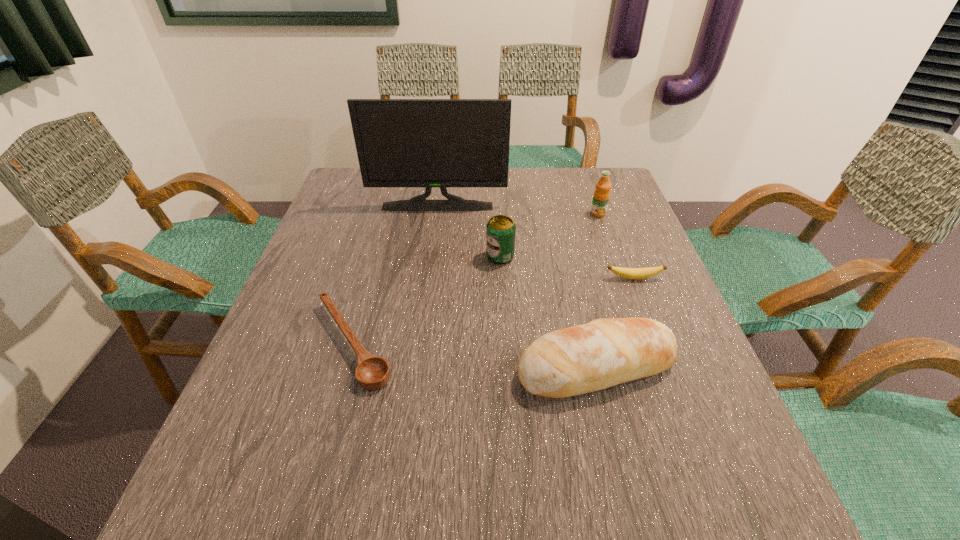
Identify the location of the tallest object. The image size is (960, 540). (428, 143).

This screenshot has height=540, width=960. I want to click on orange juice, so click(601, 196).

Locate an element on the screen. This screenshot has height=540, width=960. the third farthest object is located at coordinates (501, 230).

At what (x,y) coordinates should I click in order to perform the action: click on bread. Please return your answer as a coordinate pair (x, y). Looking at the image, I should click on (580, 359).

Identify the location of banana. (631, 273).

Where is `wooden spoon`? wooden spoon is located at coordinates (372, 372).

You are a GUI agent. You are given a task and a screenshot of the screen. Output one action in this format:
    pyautogui.click(x=<x>, y=<y>)
    Task: Click on the free space located 0.400m on the front-facing side of the monitor
    Image resolution: width=960 pixels, height=540 pixels.
    Given the screenshot: What is the action you would take?
    pyautogui.click(x=423, y=312)

The width and height of the screenshot is (960, 540). I want to click on vacant region located on the label of the orange juice, so click(x=616, y=266).

This screenshot has width=960, height=540. Find the location of `free space located 0.400m on the front of the beer can`. free space located 0.400m on the front of the beer can is located at coordinates (509, 410).

Locate an element on the screen. The width and height of the screenshot is (960, 540). vacant area situated 0.150m on the front of the bread is located at coordinates (626, 489).